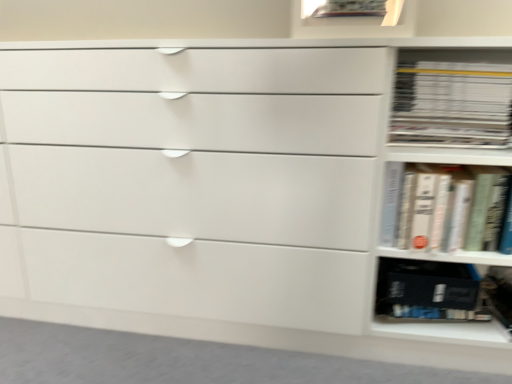
Question: From a real-world perspective, is black matte book at lower right over white matte book at right, placed as the 2th book when sorted from top to bottom?

Choices:
 (A) no
 (B) yes

Answer: (A)

Question: Considering the relative sizes of black matte book at lower right and white matte book at right, placed as the 2th book when sorted from top to bottom, in the image provided, is black matte book at lower right bigger than white matte book at right, placed as the 2th book when sorted from top to bottom,?

Choices:
 (A) yes
 (B) no

Answer: (B)

Question: Is black matte book at lower right behind white matte book at right, placed as the 2th book when sorted from top to bottom?

Choices:
 (A) yes
 (B) no

Answer: (A)

Question: Could white matte book at right, acting as the first book starting from the bottom, be considered to be inside black matte book at lower right?

Choices:
 (A) yes
 (B) no

Answer: (B)

Question: Does black matte book at lower right have a lesser height compared to white matte book at right, placed as the 2th book when sorted from top to bottom?

Choices:
 (A) yes
 (B) no

Answer: (A)

Question: Can you confirm if black matte book at lower right is taller than white matte book at right, acting as the first book starting from the bottom?

Choices:
 (A) no
 (B) yes

Answer: (A)

Question: Considering the relative sizes of white glossy book at right, which is counted as the first book, starting from the top, and white matte book at right, placed as the 2th book when sorted from top to bottom, in the image provided, is white glossy book at right, which is counted as the first book, starting from the top, bigger than white matte book at right, placed as the 2th book when sorted from top to bottom,?

Choices:
 (A) yes
 (B) no

Answer: (B)

Question: From the image's perspective, is white glossy book at right, which is counted as the first book, starting from the top, beneath white matte book at right, placed as the 2th book when sorted from top to bottom?

Choices:
 (A) yes
 (B) no

Answer: (B)

Question: Is white glossy book at right, which is the 2th book from bottom to top, shorter than white matte book at right, acting as the first book starting from the bottom?

Choices:
 (A) yes
 (B) no

Answer: (A)

Question: From a real-world perspective, is white glossy book at right, which is counted as the first book, starting from the top, physically below white matte book at right, acting as the first book starting from the bottom?

Choices:
 (A) yes
 (B) no

Answer: (B)

Question: Is white glossy book at right, which is counted as the first book, starting from the top, smaller than white matte book at right, placed as the 2th book when sorted from top to bottom?

Choices:
 (A) no
 (B) yes

Answer: (B)

Question: Does white glossy book at right, which is counted as the first book, starting from the top, appear on the right side of white matte book at right, acting as the first book starting from the bottom?

Choices:
 (A) no
 (B) yes

Answer: (A)

Question: Is white matte book at right, acting as the first book starting from the bottom, wider than white glossy book at right, which is the 2th book from bottom to top?

Choices:
 (A) yes
 (B) no

Answer: (B)